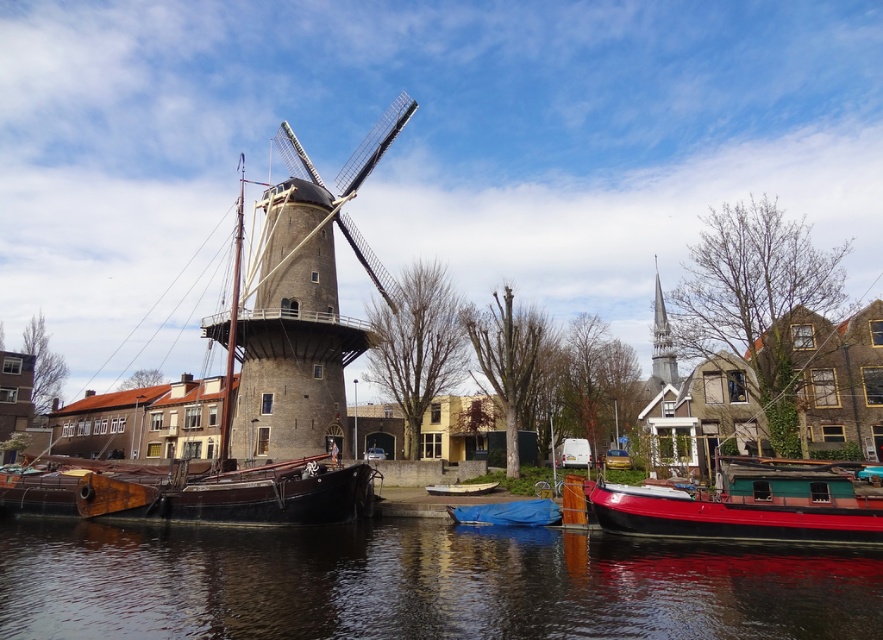
Which of these two, shiny red boat at lower right or blue tarpaulin boat at center, stands taller?

shiny red boat at lower right

Which is behind, point (730, 481) or point (484, 508)?

The point (484, 508) is more distant.

Identify the location of shiny red boat at lower right. This screenshot has height=640, width=883. (752, 504).

The width and height of the screenshot is (883, 640). Identify the location of shiny red boat at lower right. (752, 504).

Between blue tarpaulin boat at center and white matte boat at center, which one has more height?

Standing taller between the two is blue tarpaulin boat at center.

Does blue tarpaulin boat at center appear over white matte boat at center?

Yes, blue tarpaulin boat at center is above white matte boat at center.

What do you see at coordinates (507, 513) in the screenshot?
I see `blue tarpaulin boat at center` at bounding box center [507, 513].

Locate an element on the screen. blue tarpaulin boat at center is located at coordinates (507, 513).

Is point (17, 593) farther from viewer compared to point (540, 518)?

No, (17, 593) is in front of (540, 518).

Between point (761, 604) and point (468, 524), which one is positioned behind?

Positioned behind is point (468, 524).

Between point (228, 593) and point (549, 500), which one is positioned behind?

Point (549, 500)

Image resolution: width=883 pixels, height=640 pixels. I want to click on smooth water at lower center, so click(x=419, y=582).